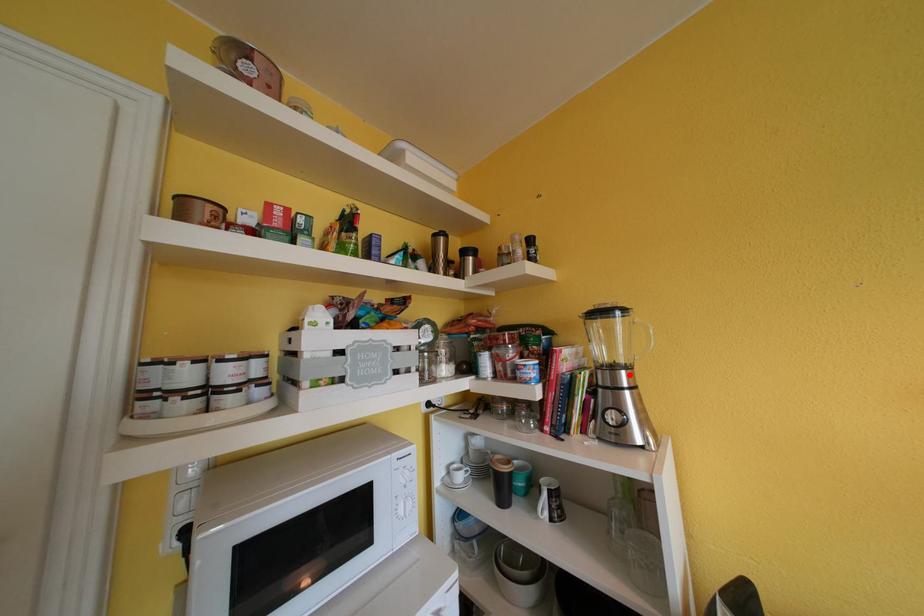
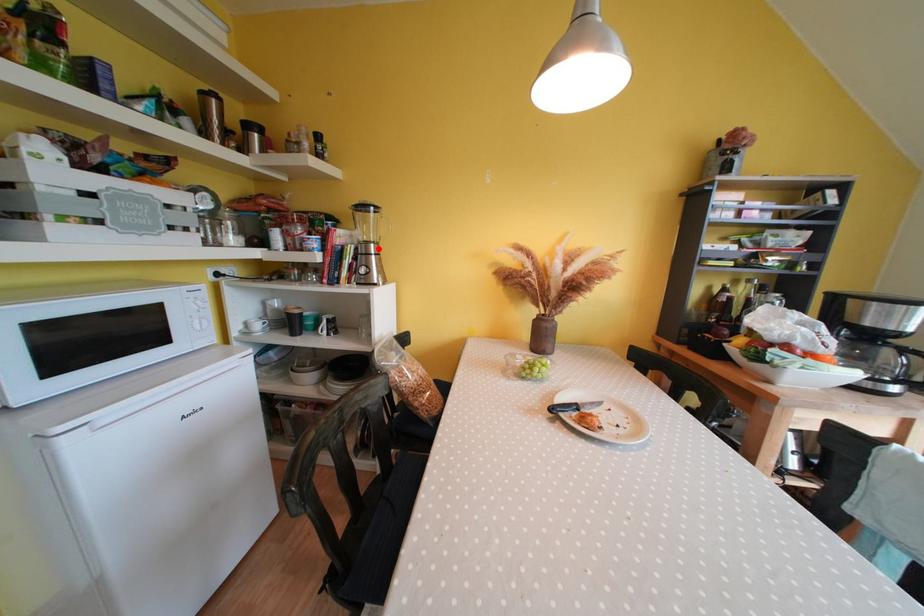
I am providing you with two images of the same scene from different viewpoints. A red point is marked on the first image and another point is marked on the second image. Do the highlighted points in image1 and image2 indicate the same real-world spot?

Yes